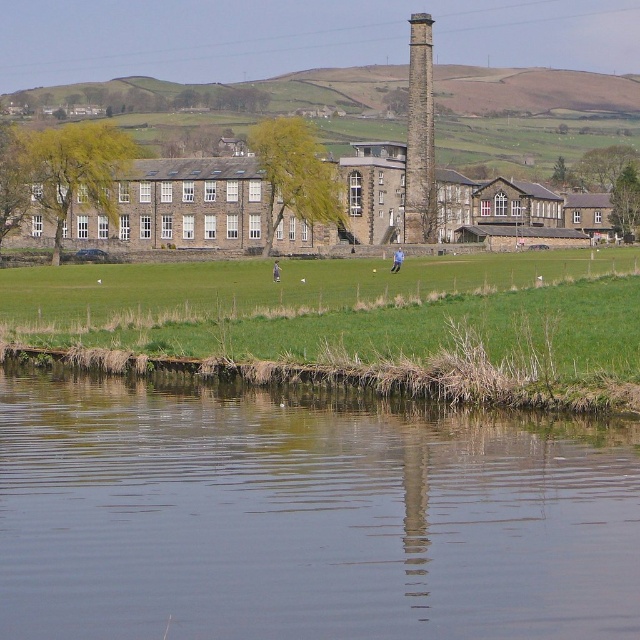
Between transparent water at lower center and smooth stone chimney at upper center, which one has less height?

Standing shorter between the two is transparent water at lower center.

Is transparent water at lower center below smooth stone chimney at upper center?

Correct, transparent water at lower center is located below smooth stone chimney at upper center.

Where is `transparent water at lower center`? The height and width of the screenshot is (640, 640). transparent water at lower center is located at coordinates (305, 515).

This screenshot has height=640, width=640. What are the coordinates of `transparent water at lower center` in the screenshot? It's located at (x=305, y=515).